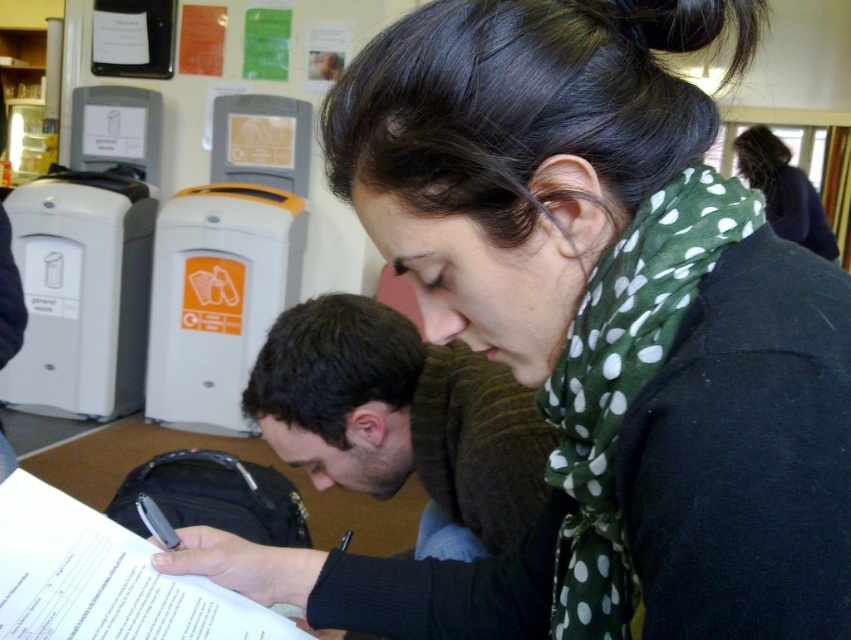
Question: Is dark brown hair at center positioned before green polka dot scarf at upper right?

Choices:
 (A) no
 (B) yes

Answer: (B)

Question: Which object appears closest to the camera in this image?

Choices:
 (A) green polka dot scarf at upper right
 (B) dark brown hair at center

Answer: (B)

Question: Does dark brown hair at center appear over green polka dot scarf at upper right?

Choices:
 (A) yes
 (B) no

Answer: (B)

Question: Among these objects, which one is nearest to the camera?

Choices:
 (A) dark brown hair at center
 (B) white paper at lower left

Answer: (B)

Question: Observing the image, what is the correct spatial positioning of dark brown hair at center in reference to white paper at lower left?

Choices:
 (A) above
 (B) below

Answer: (A)

Question: Estimate the real-world distances between objects in this image. Which object is farther from the green polka dot scarf at upper right?

Choices:
 (A) dark brown hair at center
 (B) white paper at lower left

Answer: (B)